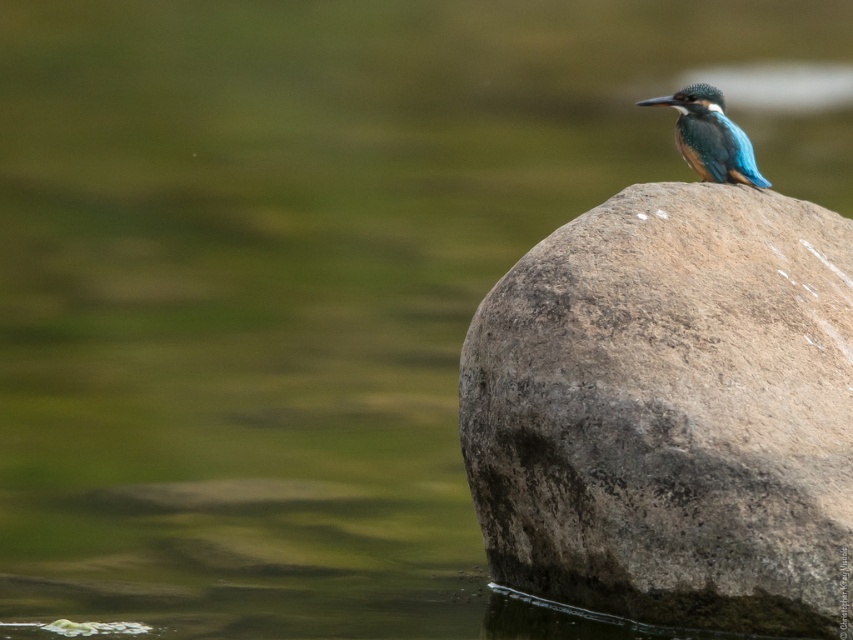
Looking at this image, you are standing at the edge of the water and see the rough stone boulder at center and the blue glossy kingfisher at center. Which object is nearer to you?

The rough stone boulder at center is closer to the viewer than the blue glossy kingfisher at center, so the rough stone boulder at center is nearer to you.

You are a photographer aiming to capture the blue glossy kingfisher at center and the rough stone boulder at center in a single frame. Based on their sizes, which object should you focus on first to ensure both are clearly visible in the photo?

The rough stone boulder at center might be wider than blue glossy kingfisher at center, so focusing on the rough stone boulder at center first would help ensure both are visible as it occupies more space in the frame.